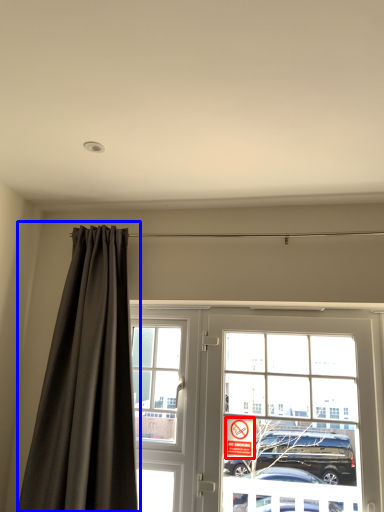
Question: Which point is further to the camera, parking sign (highlighted by a red box) or curtain (highlighted by a blue box)?

Choices:
 (A) parking sign
 (B) curtain

Answer: (A)